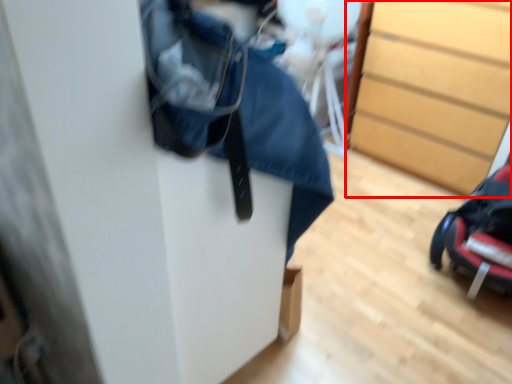
Question: From the image, what is the correct spatial relationship of chest of drawers (annotated by the red box) in relation to baby carriage?

Choices:
 (A) right
 (B) left

Answer: (A)